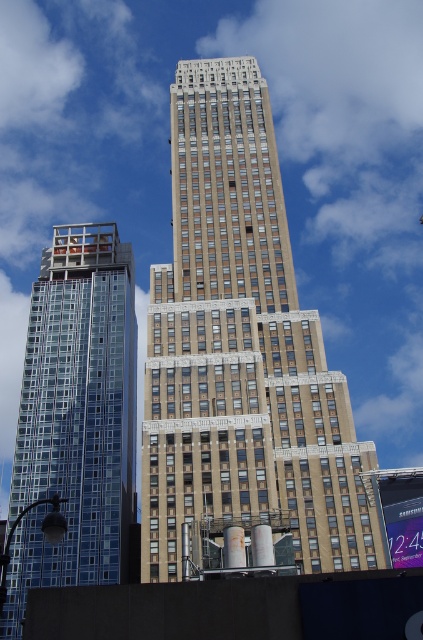
You are standing in front of the two skyscrapers and want to take a photo. You notice two points marked on the buildings. The first point is at coordinates point (364,492) and the second is at point (114,323). Which point will appear larger in your photo?

Point (364,492) is closer to the camera than point (114,323), so it will appear larger in the photo.

You are standing at point A which is at the location of point (x=241, y=355) in the image. You want to know which building is closer to you between the modern glass building on the left and the traditional beige building on the right. Can you determine this based on your position?

The brown stone building at center is located at point (x=241, y=355), which is between the modern glass building on the left and the traditional beige building on the right. Since you are standing at the brown stone building at center, you are equidistant to both buildings.

You are an architect analyzing the skyline of this city. You notice the brown stone building at center and the glassy blue skyscraper at left. Which building is positioned higher in the image?

The brown stone building at center is above the glassy blue skyscraper at left, so it is positioned higher in the image.